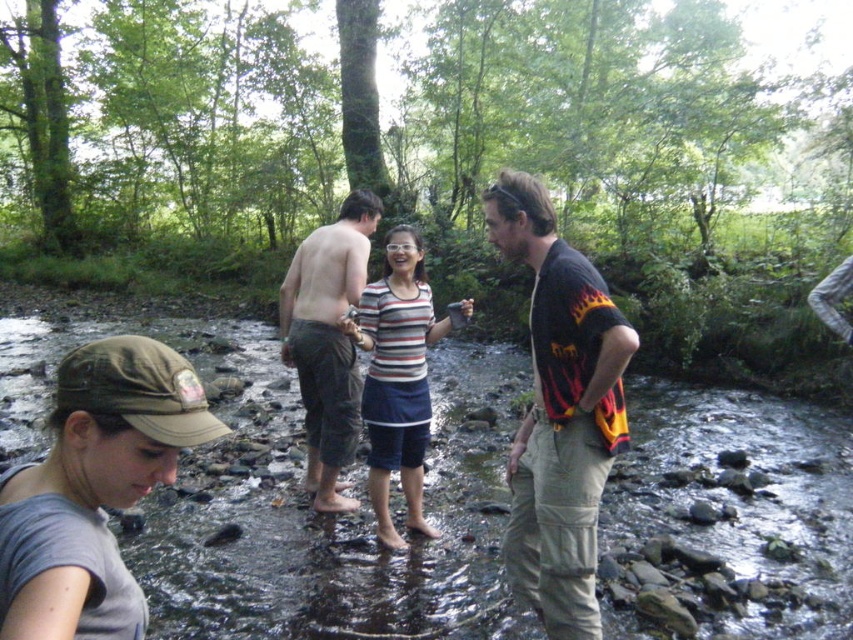
You are standing in the stream and want to hand a black cotton shirt at center to someone across the stream. The stream is 6 feet wide. Can you reach them without getting your feet wet?

The black cotton shirt at center and viewer are 7.11 feet apart. Since the stream is only 6 feet wide, you can reach them without stepping into the water.

You are a photographer trying to capture a clear shot of the black cotton shirt at center without the gray matte cap at lower left blocking it. Based on their positions, can you adjust your camera angle to avoid the cap?

The gray matte cap at lower left is positioned over the black cotton shirt at center, so adjusting the camera angle downward might help avoid the cap blocking the shirt.